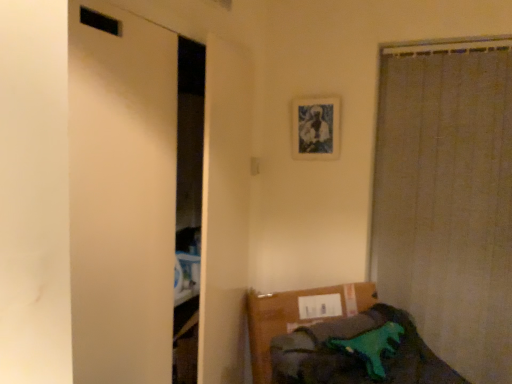
What do you see at coordinates (447, 197) in the screenshot? I see `beige textured curtain at right` at bounding box center [447, 197].

Locate an element on the screen. The height and width of the screenshot is (384, 512). blue textured fabric picture frame at upper center is located at coordinates (316, 128).

Looking at this image, is green plastic toy dinosaur at lower right at the back of beige textured curtain at right?

No, green plastic toy dinosaur at lower right is not at the back of beige textured curtain at right.

Between beige textured curtain at right and green plastic toy dinosaur at lower right, which one appears on the left side from the viewer's perspective?

Positioned to the left is green plastic toy dinosaur at lower right.

Between beige textured curtain at right and green plastic toy dinosaur at lower right, which one is positioned behind?

Positioned behind is beige textured curtain at right.

Which of these two, beige textured curtain at right or green plastic toy dinosaur at lower right, stands shorter?

With less height is green plastic toy dinosaur at lower right.

Which is farther from the camera, (298,130) or (344,328)?

The point (298,130) is more distant.

Locate an element on the screen. furniture below the blue textured fabric picture frame at upper center (from a real-world perspective) is located at coordinates (339, 340).

Is blue textured fabric picture frame at upper center to the left or to the right of green plastic toy dinosaur at lower right in the image?

Based on their positions, blue textured fabric picture frame at upper center is located to the left of green plastic toy dinosaur at lower right.

Can you tell me how much blue textured fabric picture frame at upper center and green plastic toy dinosaur at lower right differ in facing direction?

blue textured fabric picture frame at upper center and green plastic toy dinosaur at lower right are facing 55.3 degrees away from each other.

Is beige textured curtain at right oriented towards blue textured fabric picture frame at upper center?

No, beige textured curtain at right is not facing towards blue textured fabric picture frame at upper center.

Between beige textured curtain at right and blue textured fabric picture frame at upper center, which one has smaller size?

Smaller between the two is blue textured fabric picture frame at upper center.

Which object is thinner, beige textured curtain at right or blue textured fabric picture frame at upper center?

With smaller width is blue textured fabric picture frame at upper center.

From the image's perspective, between beige textured curtain at right and blue textured fabric picture frame at upper center, who is located below?

beige textured curtain at right, from the image's perspective.

Would you consider blue textured fabric picture frame at upper center to be distant from beige textured curtain at right?

No.

From the picture: Can you confirm if blue textured fabric picture frame at upper center is taller than beige textured curtain at right?

No, blue textured fabric picture frame at upper center is not taller than beige textured curtain at right.

Is blue textured fabric picture frame at upper center to the left of beige textured curtain at right from the viewer's perspective?

Indeed, blue textured fabric picture frame at upper center is positioned on the left side of beige textured curtain at right.

From the image's perspective, would you say blue textured fabric picture frame at upper center is shown under beige textured curtain at right?

Incorrect, from the image's perspective, blue textured fabric picture frame at upper center is higher than beige textured curtain at right.

From the image's perspective, is green plastic toy dinosaur at lower right positioned above or below blue textured fabric picture frame at upper center?

Based on their image positions, green plastic toy dinosaur at lower right is located beneath blue textured fabric picture frame at upper center.

Consider the image. Measure the distance between green plastic toy dinosaur at lower right and blue textured fabric picture frame at upper center.

green plastic toy dinosaur at lower right and blue textured fabric picture frame at upper center are 33.26 inches apart from each other.

From the picture: Is green plastic toy dinosaur at lower right far away from blue textured fabric picture frame at upper center?

No, green plastic toy dinosaur at lower right is not far from blue textured fabric picture frame at upper center.

How different are the orientations of green plastic toy dinosaur at lower right and blue textured fabric picture frame at upper center in degrees?

The angular difference between green plastic toy dinosaur at lower right and blue textured fabric picture frame at upper center is 55.3 degrees.

Can you confirm if green plastic toy dinosaur at lower right is taller than beige textured curtain at right?

Incorrect, the height of green plastic toy dinosaur at lower right is not larger of that of beige textured curtain at right.

Between green plastic toy dinosaur at lower right and beige textured curtain at right, which one has larger width?

With larger width is green plastic toy dinosaur at lower right.

Where is `curtain above the green plastic toy dinosaur at lower right (from a real-world perspective)`? This screenshot has width=512, height=384. curtain above the green plastic toy dinosaur at lower right (from a real-world perspective) is located at coordinates (447, 197).

Locate an element on the screen. Image resolution: width=512 pixels, height=384 pixels. picture frame on the left of green plastic toy dinosaur at lower right is located at coordinates (316, 128).

Looking at the image, which one is located further to green plastic toy dinosaur at lower right, beige textured curtain at right or blue textured fabric picture frame at upper center?

blue textured fabric picture frame at upper center is positioned further to the anchor green plastic toy dinosaur at lower right.

When comparing their distances from blue textured fabric picture frame at upper center, does beige textured curtain at right or green plastic toy dinosaur at lower right seem closer?

Among the two, beige textured curtain at right is located nearer to blue textured fabric picture frame at upper center.

From the image, which object appears to be farther from beige textured curtain at right, blue textured fabric picture frame at upper center or green plastic toy dinosaur at lower right?

green plastic toy dinosaur at lower right.

Estimate the real-world distances between objects in this image. Which object is further from beige textured curtain at right, green plastic toy dinosaur at lower right or blue textured fabric picture frame at upper center?

green plastic toy dinosaur at lower right is further to beige textured curtain at right.

Considering their positions, is green plastic toy dinosaur at lower right positioned closer to blue textured fabric picture frame at upper center than beige textured curtain at right?

beige textured curtain at right lies closer to blue textured fabric picture frame at upper center than the other object.

Considering their positions, is blue textured fabric picture frame at upper center positioned closer to green plastic toy dinosaur at lower right than beige textured curtain at right?

Among the two, beige textured curtain at right is located nearer to green plastic toy dinosaur at lower right.

The width and height of the screenshot is (512, 384). Identify the location of curtain between blue textured fabric picture frame at upper center and green plastic toy dinosaur at lower right from top to bottom. (447, 197).